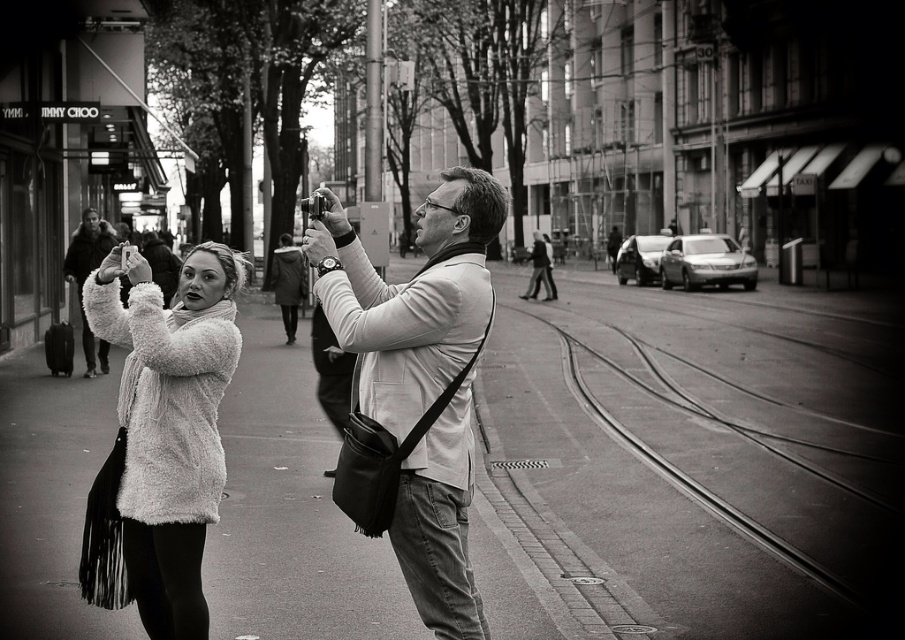
Question: Among these points, which one is nearest to the camera?

Choices:
 (A) coord(478,273)
 (B) coord(81,228)
 (C) coord(184,538)

Answer: (A)

Question: Considering the real-world distances, which object is closest to the matte black camera at center?

Choices:
 (A) fuzzy white coat at left
 (B) fuzzy white coat at center
 (C) matte white jacket at center

Answer: (B)

Question: Which object is farther from the camera taking this photo?

Choices:
 (A) matte white jacket at center
 (B) matte black camera at center

Answer: (A)

Question: Can you confirm if fuzzy white coat at center is bigger than matte white jacket at center?

Choices:
 (A) no
 (B) yes

Answer: (A)

Question: Can you confirm if matte black camera at center is positioned to the right of fuzzy white coat at center?

Choices:
 (A) no
 (B) yes

Answer: (A)

Question: Does matte black camera at center appear over matte white jacket at center?

Choices:
 (A) yes
 (B) no

Answer: (B)